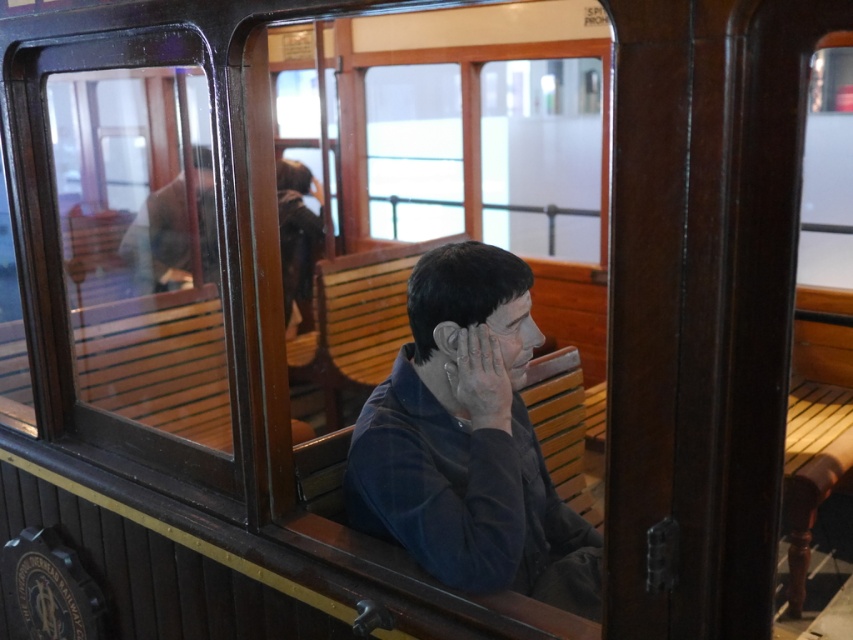
Between point (483, 422) and point (515, 356), which one is positioned in front?

Point (483, 422) is more forward.

Image resolution: width=853 pixels, height=640 pixels. What do you see at coordinates (480, 380) in the screenshot?
I see `matte gray hand at center` at bounding box center [480, 380].

The height and width of the screenshot is (640, 853). Identify the location of matte gray hand at center. (480, 380).

Who is taller, matte blue shirt at center or matte gray hand at center?

With more height is matte blue shirt at center.

Is matte blue shirt at center below matte gray hand at center?

Yes, matte blue shirt at center is below matte gray hand at center.

The image size is (853, 640). In order to click on matte blue shirt at center in this screenshot , I will do `click(468, 442)`.

Is point (491, 564) behind point (492, 326)?

No, (491, 564) is closer to viewer.

Which is behind, point (575, 579) or point (524, 365)?

Point (575, 579)

Where is `matte blue shirt at center`? matte blue shirt at center is located at coordinates (468, 442).

Find the location of a particular element. Image resolution: width=853 pixels, height=640 pixels. matte blue shirt at center is located at coordinates (468, 442).